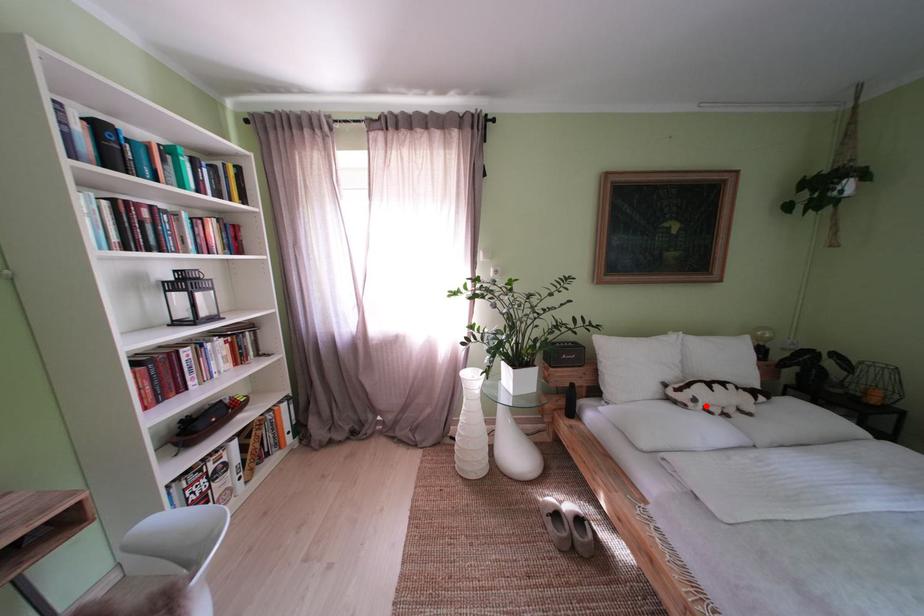
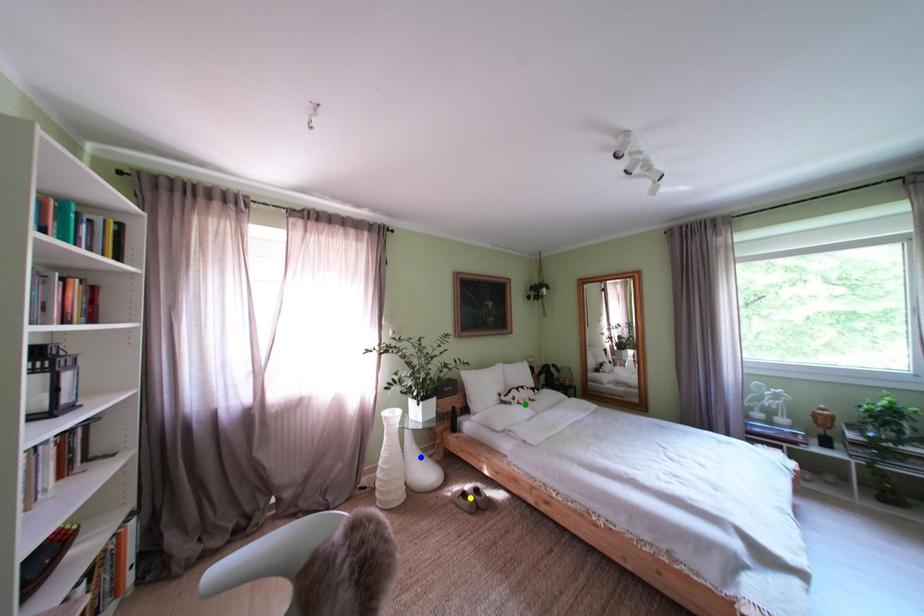
Question: I am providing you with two images of the same scene from different viewpoints. A red point is marked on the first image. You are given multiple points on the second image. Which spot in image 2 lines up with the point in image 1?

Choices:
 (A) blue point
 (B) green point
 (C) yellow point

Answer: (B)